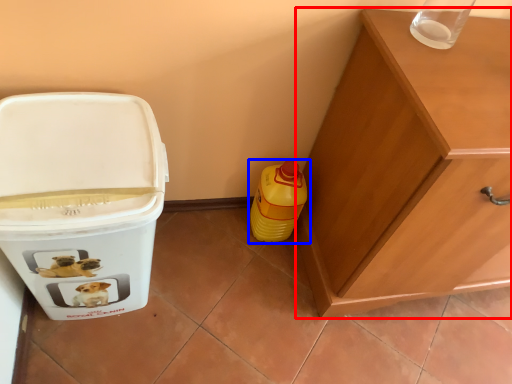
Question: Among these objects, which one is nearest to the camera, cabinetry (highlighted by a red box) or bottle (highlighted by a blue box)?

Choices:
 (A) cabinetry
 (B) bottle

Answer: (A)